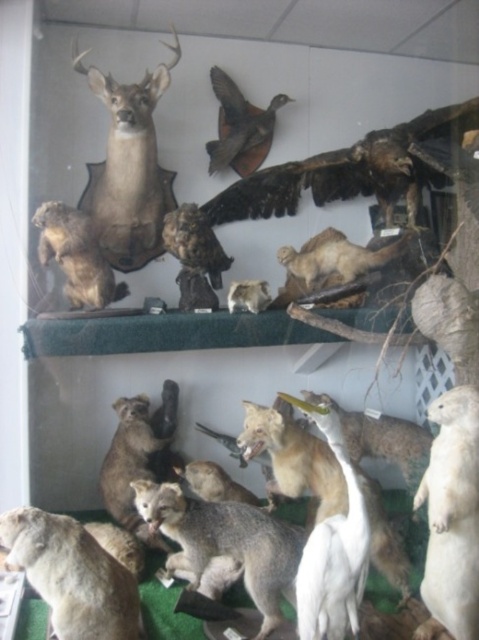
Which is more to the left, brown fur owl at upper left or brown matte bird at upper center?

brown fur owl at upper left is more to the left.

This screenshot has width=479, height=640. Describe the element at coordinates (76, 256) in the screenshot. I see `brown fur owl at upper left` at that location.

The image size is (479, 640). Identify the location of brown fur owl at upper left. (76, 256).

Does fuzzy brown fox at lower left appear under brown fur owl at upper left?

Correct, fuzzy brown fox at lower left is located below brown fur owl at upper left.

Which is above, fuzzy brown fox at lower left or brown fur owl at upper left?

brown fur owl at upper left

You are a GUI agent. You are given a task and a screenshot of the screen. Output one action in this format:
    pyautogui.click(x=<x>, y=<y>)
    Task: Click on the fuzzy brown fox at lower left
    The image size is (479, 640).
    Given the screenshot: What is the action you would take?
    pyautogui.click(x=71, y=576)

Looking at this image, who is positioned more to the right, matte brown deer at upper left or brown fur owl at upper left?

Positioned to the right is matte brown deer at upper left.

You are a GUI agent. You are given a task and a screenshot of the screen. Output one action in this format:
    pyautogui.click(x=<x>, y=<y>)
    Task: Click on the matte brown deer at upper left
    
    Given the screenshot: What is the action you would take?
    pyautogui.click(x=128, y=168)

Identify the location of matte brown deer at upper left. (128, 168).

You are a GUI agent. You are given a task and a screenshot of the screen. Output one action in this format:
    pyautogui.click(x=<x>, y=<y>)
    Task: Click on the matte brown deer at upper left
    
    Given the screenshot: What is the action you would take?
    pyautogui.click(x=128, y=168)